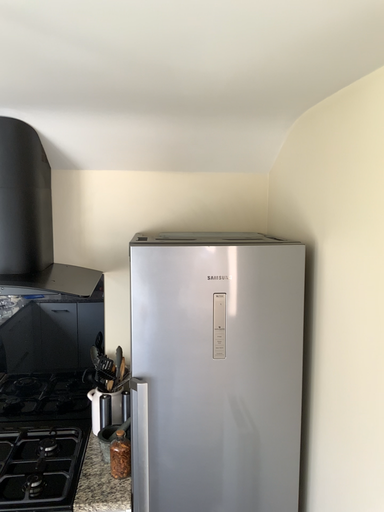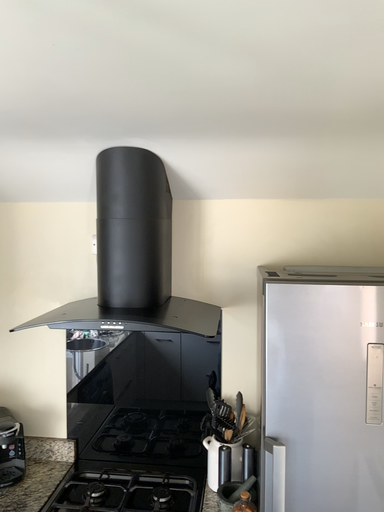
Question: How did the camera likely rotate when shooting the video?

Choices:
 (A) rotated left
 (B) rotated right

Answer: (A)